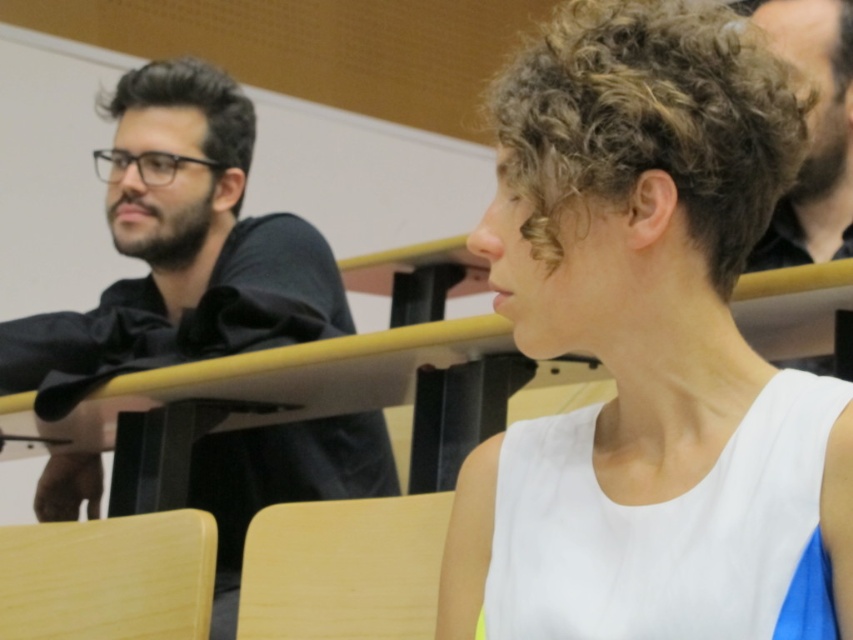
Question: Does white matte tank top at center have a smaller size compared to black matte shirt at left?

Choices:
 (A) no
 (B) yes

Answer: (B)

Question: Can you confirm if black matte shirt at left is positioned to the right of dark brown curly hair at upper right?

Choices:
 (A) yes
 (B) no

Answer: (B)

Question: Among these points, which one is farthest from the camera?

Choices:
 (A) (827, 125)
 (B) (750, 234)

Answer: (A)

Question: Which object is the farthest from the dark brown curly hair at upper right?

Choices:
 (A) black matte shirt at left
 (B) white matte tank top at center

Answer: (A)

Question: Which object appears farthest from the camera in this image?

Choices:
 (A) black matte shirt at left
 (B) white matte tank top at center
 (C) dark brown curly hair at upper right

Answer: (C)

Question: Can you confirm if white matte tank top at center is positioned below black matte shirt at left?

Choices:
 (A) no
 (B) yes

Answer: (A)